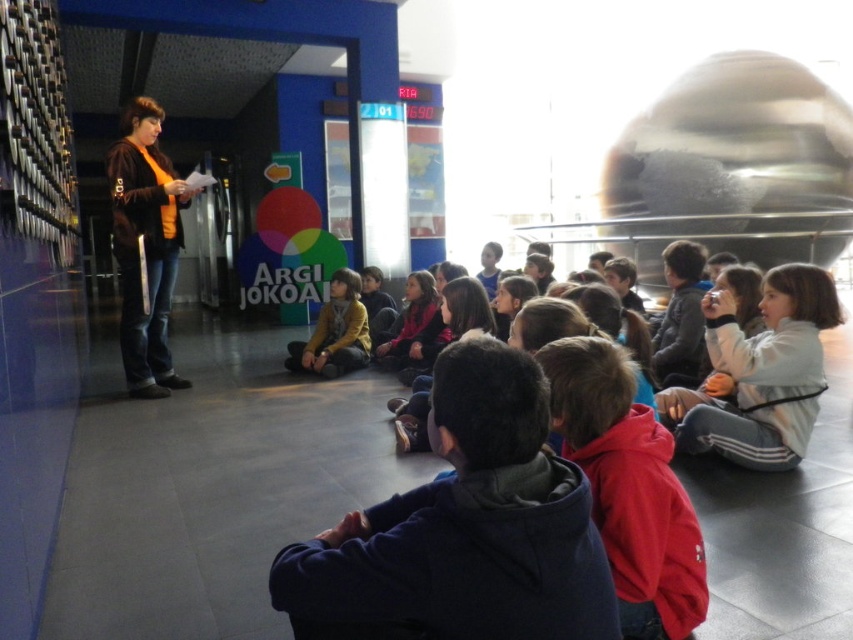
Question: Among these objects, which one is farthest from the camera?

Choices:
 (A) white fleece jacket at lower right
 (B) orange fleece jacket at left
 (C) matte yellow sweater at center

Answer: (C)

Question: Which point is farther to the camera?

Choices:
 (A) matte yellow sweater at center
 (B) white fleece jacket at lower right

Answer: (A)

Question: Which point appears closest to the camera in this image?

Choices:
 (A) (163, 387)
 (B) (753, 458)

Answer: (B)

Question: Observing the image, what is the correct spatial positioning of white fleece jacket at lower right in reference to matte yellow sweater at center?

Choices:
 (A) below
 (B) above

Answer: (A)

Question: Does orange fleece jacket at left have a lesser width compared to matte yellow sweater at center?

Choices:
 (A) yes
 (B) no

Answer: (A)

Question: Where is red fleece jacket at lower right located in relation to matte yellow sweater at center in the image?

Choices:
 (A) above
 (B) below

Answer: (B)